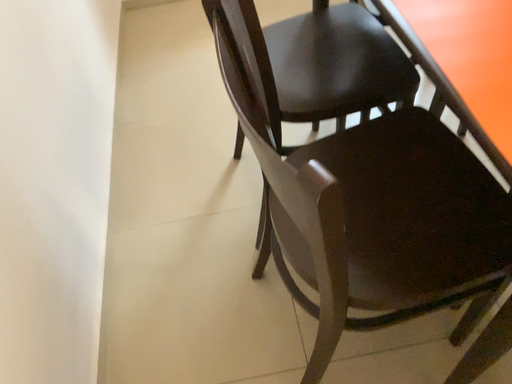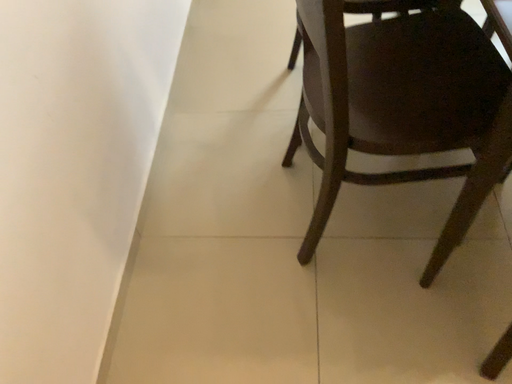
Question: How did the camera likely rotate when shooting the video?

Choices:
 (A) rotated left
 (B) rotated right

Answer: (A)